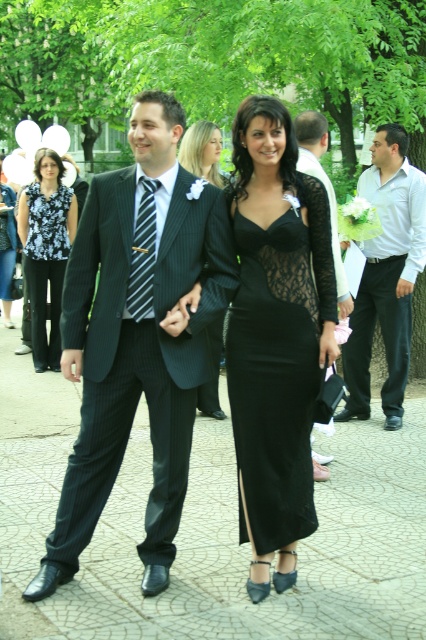
Question: Which of the following is the closest to the observer?

Choices:
 (A) (60, 268)
 (B) (189, 131)
 (C) (347, 294)
 (D) (238, 488)

Answer: (D)

Question: Is floral print blouse at center bigger than black lace dress at center?

Choices:
 (A) yes
 (B) no

Answer: (A)

Question: Is matte black suit at center further to the viewer compared to black lace dress at center?

Choices:
 (A) no
 (B) yes

Answer: (B)

Question: Which of the following is the closest to the observer?

Choices:
 (A) (419, 189)
 (B) (37, 296)
 (C) (152, 220)

Answer: (C)

Question: Which object appears farthest from the camera in this image?

Choices:
 (A) pinstriped fabric tie at center
 (B) floral print blouse at center

Answer: (B)

Question: Does matte black suit at center appear under matte black dress at center?

Choices:
 (A) no
 (B) yes

Answer: (B)